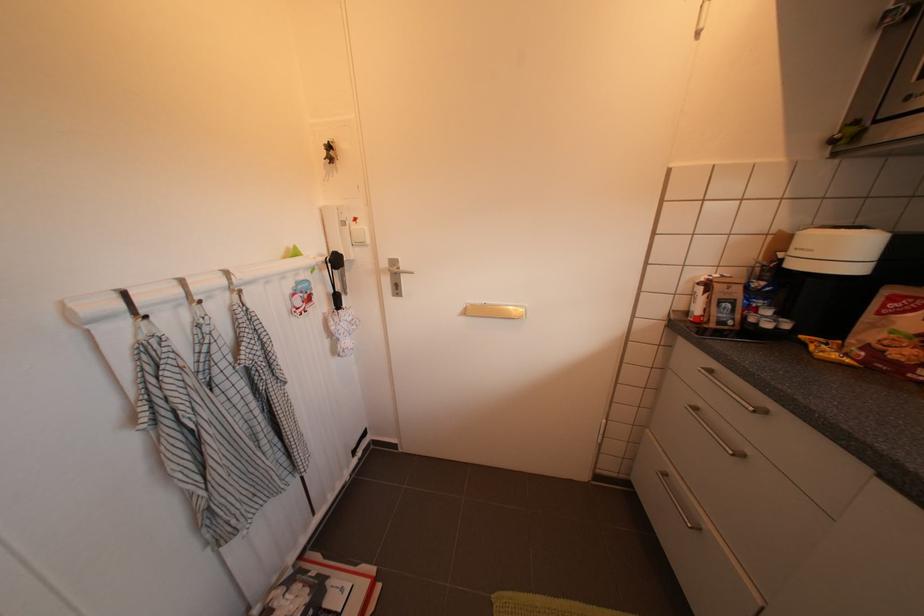
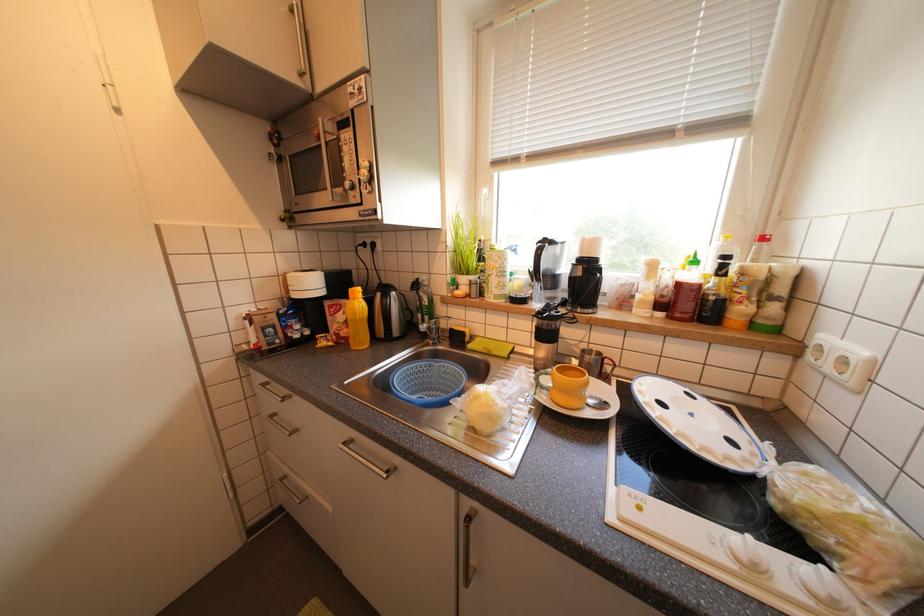
Question: The camera is either moving clockwise (left) or counter-clockwise (right) around the object. The first image is from the beginning of the video and the second image is from the end. Is the camera moving left or right when shooting the video?

Choices:
 (A) Left
 (B) Right

Answer: (A)